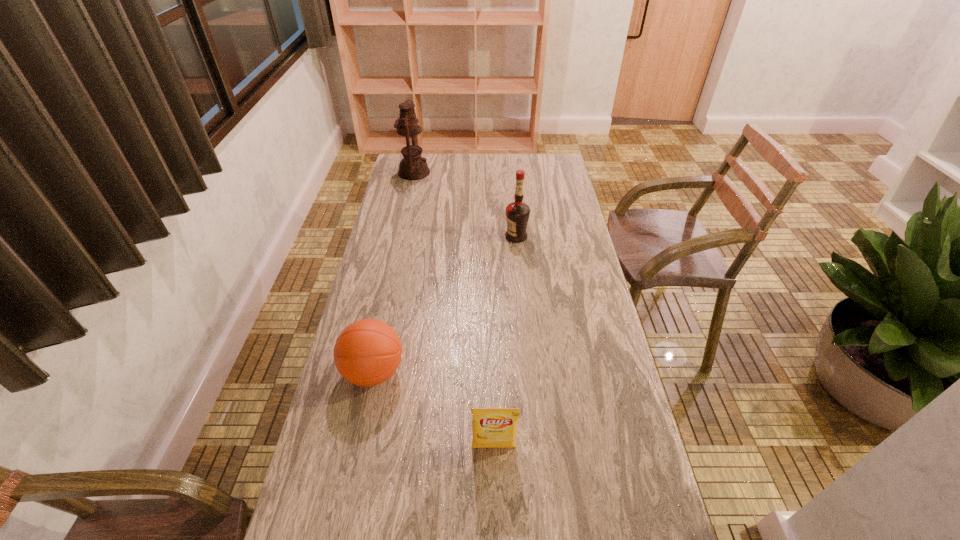
Locate an element on the screen. The height and width of the screenshot is (540, 960). blank space located on the right of the basketball is located at coordinates (539, 372).

You are a GUI agent. You are given a task and a screenshot of the screen. Output one action in this format:
    pyautogui.click(x=<x>, y=<y>)
    Task: Click on the vacant space situated 0.100m on the front of the crisp (potato chip) with the logo
    The height and width of the screenshot is (540, 960).
    Given the screenshot: What is the action you would take?
    [x=495, y=497]

The width and height of the screenshot is (960, 540). I want to click on object present at the far edge, so click(x=412, y=167).

You are a GUI agent. You are given a task and a screenshot of the screen. Output one action in this format:
    pyautogui.click(x=<x>, y=<y>)
    Task: Click on the oil lamp located at the left edge
    Image resolution: width=960 pixels, height=540 pixels.
    Given the screenshot: What is the action you would take?
    pyautogui.click(x=412, y=167)

The width and height of the screenshot is (960, 540). What are the coordinates of `basketball at the left edge` in the screenshot? It's located at (367, 352).

You are a GUI agent. You are given a task and a screenshot of the screen. Output one action in this format:
    pyautogui.click(x=<x>, y=<y>)
    Task: Click on the object at the far left corner
    Image resolution: width=960 pixels, height=540 pixels.
    Given the screenshot: What is the action you would take?
    pyautogui.click(x=412, y=167)

At what (x,y) coordinates should I click in order to perform the action: click on vacant space at the far edge of the desktop. Please return your answer as a coordinate pair (x, y). Looking at the image, I should click on (470, 153).

In the image, there is a desktop. Where is `free space at the left edge`? free space at the left edge is located at coordinates (370, 307).

The image size is (960, 540). I want to click on vacant space at the right edge, so click(x=601, y=318).

What are the coordinates of `free spot at the far right corner of the desktop` in the screenshot? It's located at (564, 172).